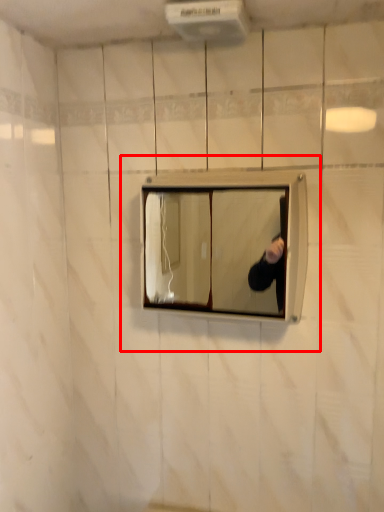
Question: From the image's perspective, what is the correct spatial positioning of medicine cabinet (annotated by the red box) in reference to air conditioner?

Choices:
 (A) below
 (B) above

Answer: (A)